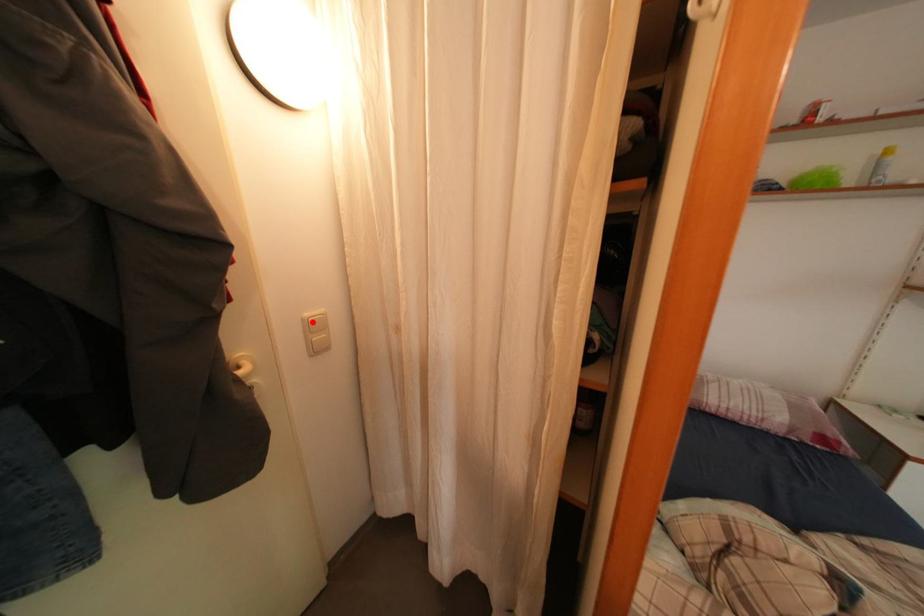
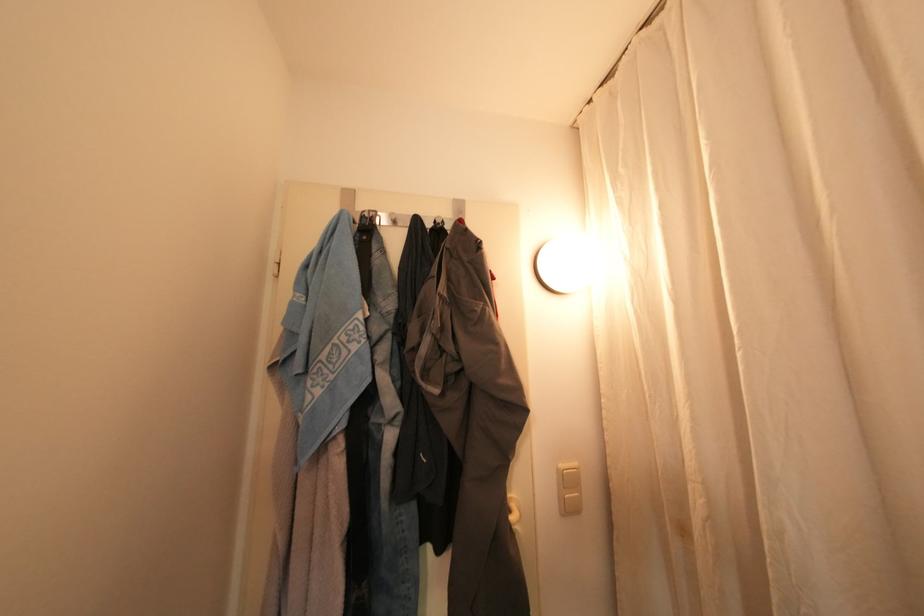
In the second image, find the point that corresponds to the highlighted location in the first image.

(568, 474)